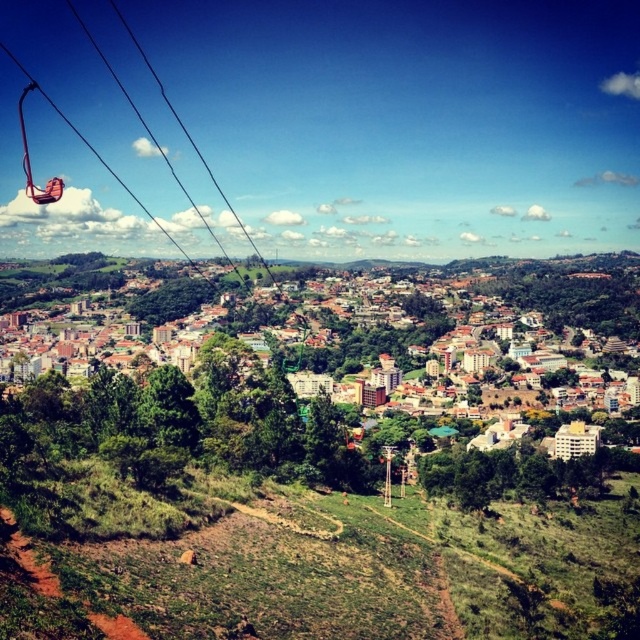
Is green leafy trees at center bigger than metallic orange ski lift at left?

Yes.

Can you confirm if green leafy trees at center is positioned to the left of metallic orange ski lift at left?

Incorrect, green leafy trees at center is not on the left side of metallic orange ski lift at left.

What do you see at coordinates (333, 390) in the screenshot? The width and height of the screenshot is (640, 640). I see `green leafy trees at center` at bounding box center [333, 390].

I want to click on green leafy trees at center, so click(333, 390).